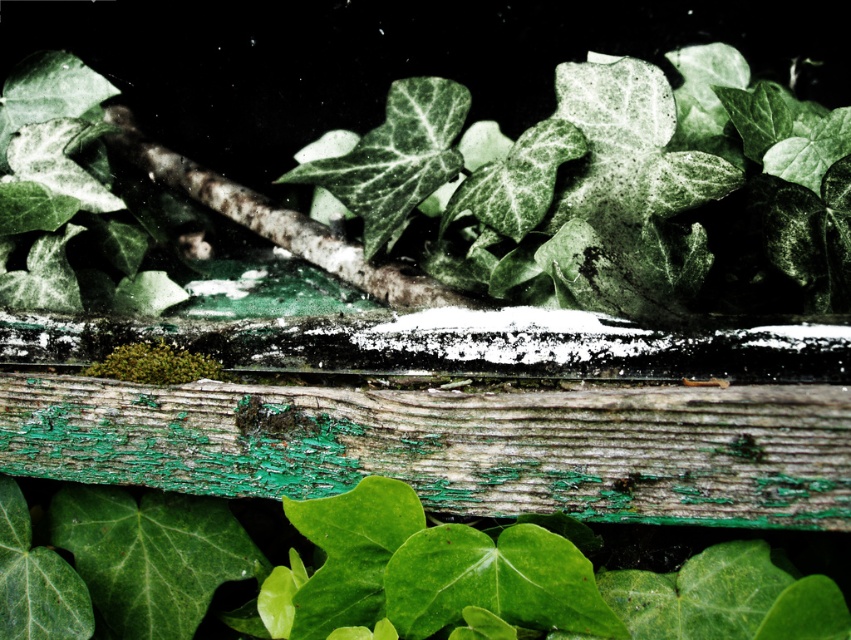
What do you see at coordinates (453, 445) in the screenshot? This screenshot has height=640, width=851. I see `peeling green paint wood plank at center` at bounding box center [453, 445].

How far apart are peeling green paint wood plank at center and green matte leaves at center?

11.75 inches

What do you see at coordinates (453, 445) in the screenshot? I see `peeling green paint wood plank at center` at bounding box center [453, 445].

This screenshot has width=851, height=640. What are the coordinates of `peeling green paint wood plank at center` in the screenshot? It's located at (453, 445).